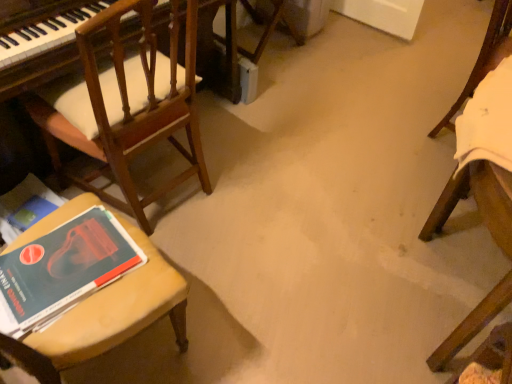
Question: Is hardcover book at lower left aimed at white fabric chair at right, the second chair positioned from the left?

Choices:
 (A) no
 (B) yes

Answer: (B)

Question: Is white fabric chair at right, the second chair positioned from the left, located within hardcover book at lower left?

Choices:
 (A) no
 (B) yes

Answer: (A)

Question: Is hardcover book at lower left not within white fabric chair at right, arranged as the 1th chair when viewed from the right?

Choices:
 (A) yes
 (B) no

Answer: (A)

Question: Can you confirm if hardcover book at lower left is shorter than white fabric chair at right, the second chair positioned from the left?

Choices:
 (A) no
 (B) yes

Answer: (B)

Question: From the image's perspective, is hardcover book at lower left above white fabric chair at right, arranged as the 1th chair when viewed from the right?

Choices:
 (A) yes
 (B) no

Answer: (B)

Question: Is hardcover book at lower left oriented away from white fabric chair at right, the second chair positioned from the left?

Choices:
 (A) no
 (B) yes

Answer: (A)

Question: Does white fabric chair at right, the second chair positioned from the left, have a larger size compared to hardcover book at lower left?

Choices:
 (A) no
 (B) yes

Answer: (B)

Question: Does white fabric chair at right, the second chair positioned from the left, lie in front of hardcover book at lower left?

Choices:
 (A) yes
 (B) no

Answer: (B)

Question: Is white fabric chair at right, the second chair positioned from the left, wider than hardcover book at lower left?

Choices:
 (A) no
 (B) yes

Answer: (A)

Question: From the image's perspective, would you say white fabric chair at right, arranged as the 1th chair when viewed from the right, is positioned over hardcover book at lower left?

Choices:
 (A) no
 (B) yes

Answer: (B)

Question: Is white fabric chair at right, the second chair positioned from the left, at the right side of hardcover book at lower left?

Choices:
 (A) yes
 (B) no

Answer: (A)

Question: From a real-world perspective, is white fabric chair at right, the second chair positioned from the left, over hardcover book at lower left?

Choices:
 (A) no
 (B) yes

Answer: (A)

Question: Is wooden chair at left, placed as the 2th chair when sorted from right to left, closer to camera compared to hardcover book at lower left?

Choices:
 (A) yes
 (B) no

Answer: (B)